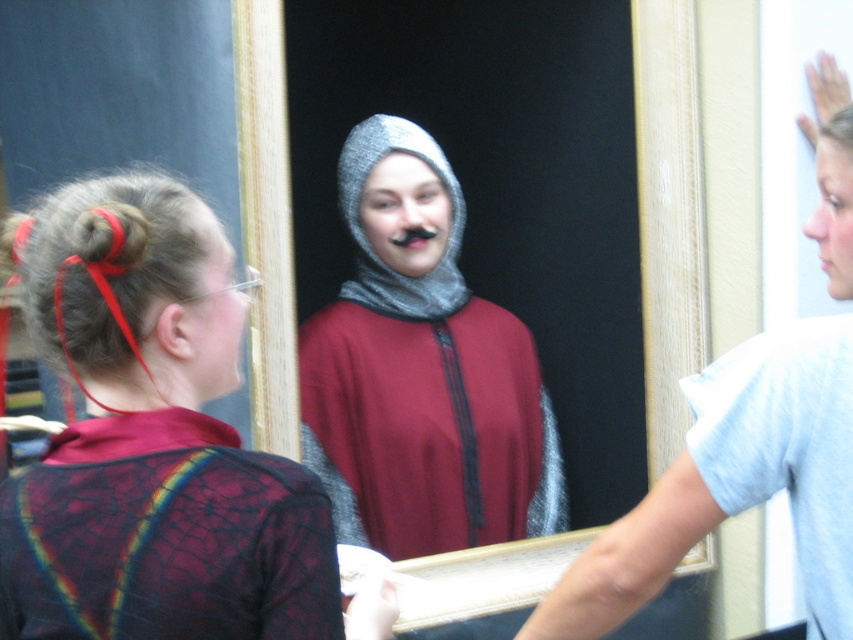
Looking at the scene described, can you determine the spatial relationship between the cracked fabric shirt at center and the crinkled fabric robe at center?

The cracked fabric shirt at center is located to the left of the crinkled fabric robe at center.

You are a costume designer trying to decide whether the crinkled fabric robe at center can be folded to fit into a storage box designed for the smooth skin face at upper right. Based on their widths, can the robe be folded to fit?

The crinkled fabric robe at center might be wider than smooth skin face at upper right, so it may require folding to fit into the storage box designed for the smooth skin face at upper right.